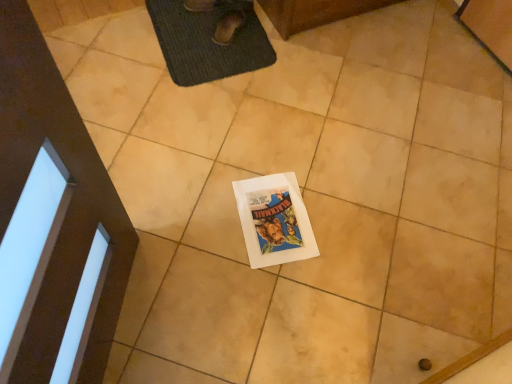
The image size is (512, 384). I want to click on vacant area that is situated to the right of white paper comic book at center, so click(347, 226).